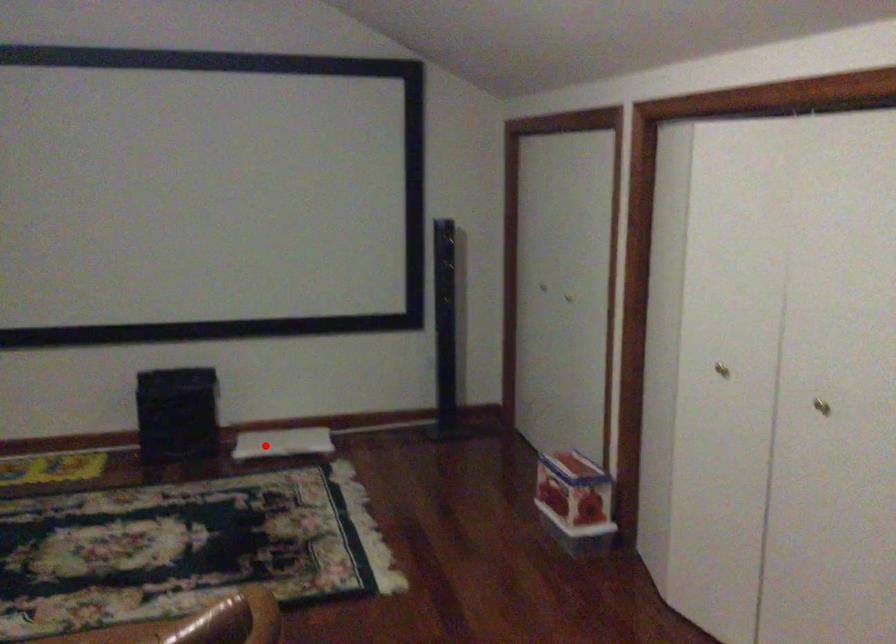
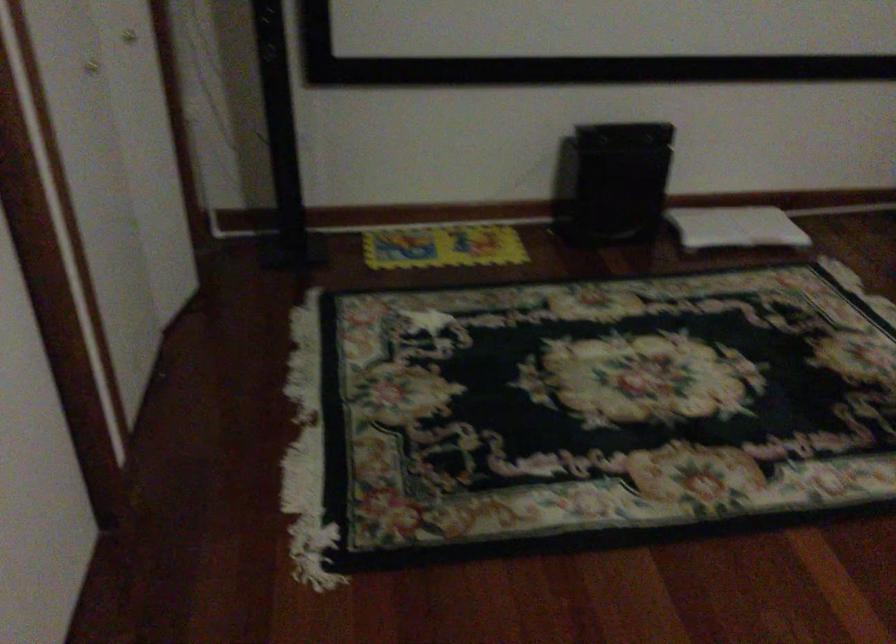
The point at the highlighted location is marked in the first image. Where is the corresponding point in the second image?

(735, 227)